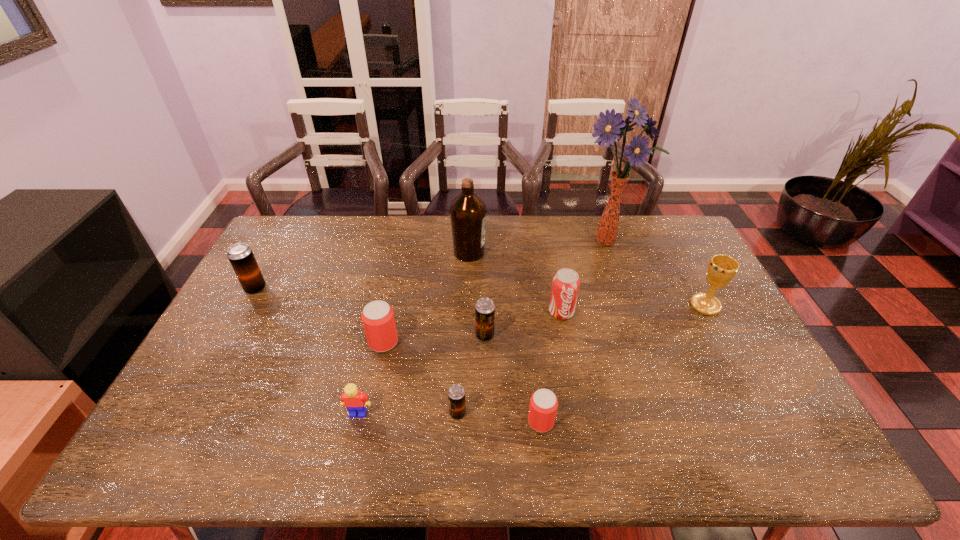
Image resolution: width=960 pixels, height=540 pixels. Identify the location of free area in between the second black beer can from right to left and the second nearest black beer can. (471, 374).

The image size is (960, 540). Find the location of `free space between the nearer red beer can and the gold chalice`. free space between the nearer red beer can and the gold chalice is located at coordinates (623, 363).

At what (x,y) coordinates should I click in order to perform the action: click on free spot between the second biggest black beer can and the gold chalice. Please return your answer as a coordinate pair (x, y). Image resolution: width=960 pixels, height=540 pixels. Looking at the image, I should click on (595, 320).

The image size is (960, 540). I want to click on free space between the smaller red beer can and the tallest object, so click(574, 330).

Image resolution: width=960 pixels, height=540 pixels. I want to click on free space between the biggest black beer can and the third beer can from right to left, so click(x=357, y=351).

Identify the location of empty location between the brown olive oil and the farther red beer can. The image size is (960, 540). (426, 297).

Where is `vacant area that lies between the second black beer can from left to right and the red soda can`? Image resolution: width=960 pixels, height=540 pixels. vacant area that lies between the second black beer can from left to right and the red soda can is located at coordinates (510, 362).

Identify which object is the closest to the nearest black beer can. Please provide its 2D coordinates. Your answer should be formatted as a tuple, i.e. [(x, y)], where the tuple contains the x and y coordinates of a point satisfying the conditions above.

[(543, 406)]

This screenshot has height=540, width=960. What are the coordinates of `object that is the closest one to the second biggest black beer can` in the screenshot? It's located at (565, 286).

Identify which beer can is the third nearest to the bigger red beer can. Please provide its 2D coordinates. Your answer should be formatted as a tuple, i.e. [(x, y)], where the tuple contains the x and y coordinates of a point satisfying the conditions above.

[(543, 406)]